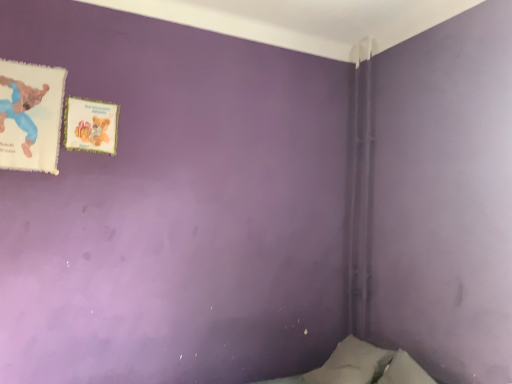
Question: Is matte paper book at upper left, the 2th paperback book from the back, outside matte paper book at upper left, which appears as the 1th paperback book when viewed from the back?

Choices:
 (A) yes
 (B) no

Answer: (A)

Question: From a real-world perspective, is matte paper book at upper left, which appears as the first paperback book when viewed from the front, physically below matte paper book at upper left, acting as the second paperback book starting from the left?

Choices:
 (A) yes
 (B) no

Answer: (A)

Question: From the image's perspective, would you say matte paper book at upper left, marked as the second paperback book in a right-to-left arrangement, is shown under matte paper book at upper left, which appears as the 1th paperback book when viewed from the back?

Choices:
 (A) no
 (B) yes

Answer: (A)

Question: Is matte paper book at upper left, which is counted as the first paperback book, starting from the left, beside matte paper book at upper left, the second paperback book from the front?

Choices:
 (A) no
 (B) yes

Answer: (A)

Question: Is matte paper book at upper left, acting as the second paperback book starting from the left, at the back of matte paper book at upper left, the 2th paperback book from the back?

Choices:
 (A) no
 (B) yes

Answer: (A)

Question: Is matte paper book at upper left, which is counted as the first paperback book, starting from the left, wider than matte paper book at upper left, the second paperback book from the front?

Choices:
 (A) yes
 (B) no

Answer: (A)

Question: Is matte paper book at upper left, the second paperback book from the front, smaller than matte paper book at upper left, which is counted as the first paperback book, starting from the left?

Choices:
 (A) yes
 (B) no

Answer: (A)

Question: Can you confirm if matte paper book at upper left, acting as the second paperback book starting from the left, is bigger than matte paper book at upper left, which is counted as the first paperback book, starting from the left?

Choices:
 (A) yes
 (B) no

Answer: (B)

Question: Is matte paper book at upper left, acting as the second paperback book starting from the left, positioned behind matte paper book at upper left, which appears as the first paperback book when viewed from the front?

Choices:
 (A) yes
 (B) no

Answer: (A)

Question: Is matte paper book at upper left, which ranks as the 1th paperback book in right-to-left order, far away from matte paper book at upper left, which appears as the first paperback book when viewed from the front?

Choices:
 (A) yes
 (B) no

Answer: (B)

Question: Considering the relative sizes of matte paper book at upper left, which ranks as the 1th paperback book in right-to-left order, and matte paper book at upper left, which appears as the first paperback book when viewed from the front, in the image provided, is matte paper book at upper left, which ranks as the 1th paperback book in right-to-left order, taller than matte paper book at upper left, which appears as the first paperback book when viewed from the front,?

Choices:
 (A) yes
 (B) no

Answer: (B)

Question: Is matte paper book at upper left, which ranks as the 1th paperback book in right-to-left order, in contact with matte paper book at upper left, the 2th paperback book from the back?

Choices:
 (A) no
 (B) yes

Answer: (A)

Question: From a real-world perspective, is matte paper book at upper left, which ranks as the 1th paperback book in right-to-left order, positioned above or below matte paper book at upper left, marked as the second paperback book in a right-to-left arrangement?

Choices:
 (A) below
 (B) above

Answer: (B)